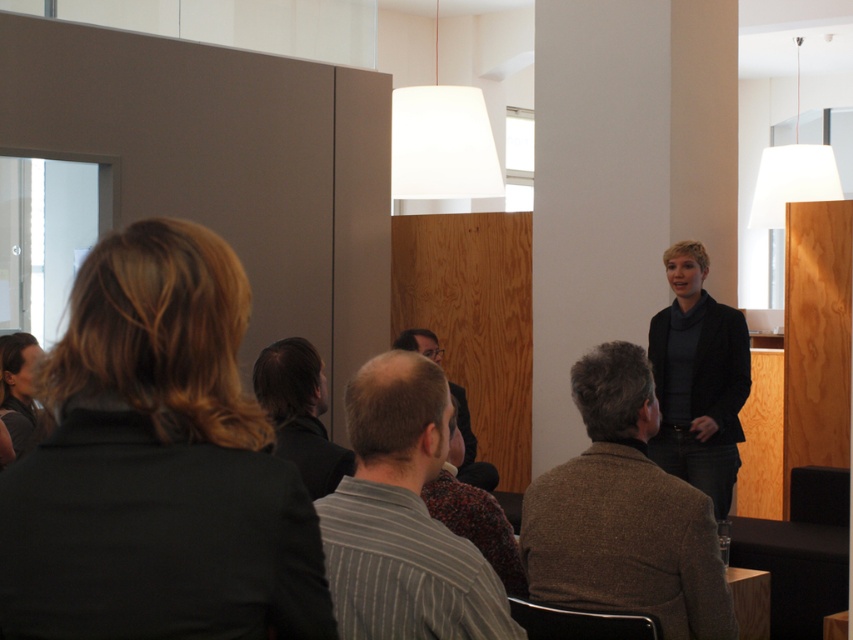
Is striped cotton shirt at center thinner than dark brown hair at center?

No.

Which is behind, point (405, 413) or point (320, 496)?

The point (320, 496) is more distant.

Is point (428, 451) more distant than point (265, 349)?

No, it is in front of (265, 349).

Find the location of `striped cotton shirt at center`. striped cotton shirt at center is located at coordinates (402, 518).

Does brown woolen sweater at center have a larger size compared to dark gray sweater at center?

No, brown woolen sweater at center is not bigger than dark gray sweater at center.

Is brown woolen sweater at center above dark gray sweater at center?

Incorrect, brown woolen sweater at center is not positioned above dark gray sweater at center.

Is point (585, 604) in front of point (727, 509)?

Yes, point (585, 604) is in front of point (727, 509).

Locate an element on the screen. brown woolen sweater at center is located at coordinates (624, 513).

Can you confirm if striped cotton shirt at center is thinner than dark gray sweater at center?

Indeed, striped cotton shirt at center has a lesser width compared to dark gray sweater at center.

Does striped cotton shirt at center have a larger size compared to dark gray sweater at center?

No, striped cotton shirt at center is not bigger than dark gray sweater at center.

Is point (367, 413) more distant than point (683, 280)?

No, (367, 413) is in front of (683, 280).

Identify the location of striped cotton shirt at center. This screenshot has height=640, width=853. (402, 518).